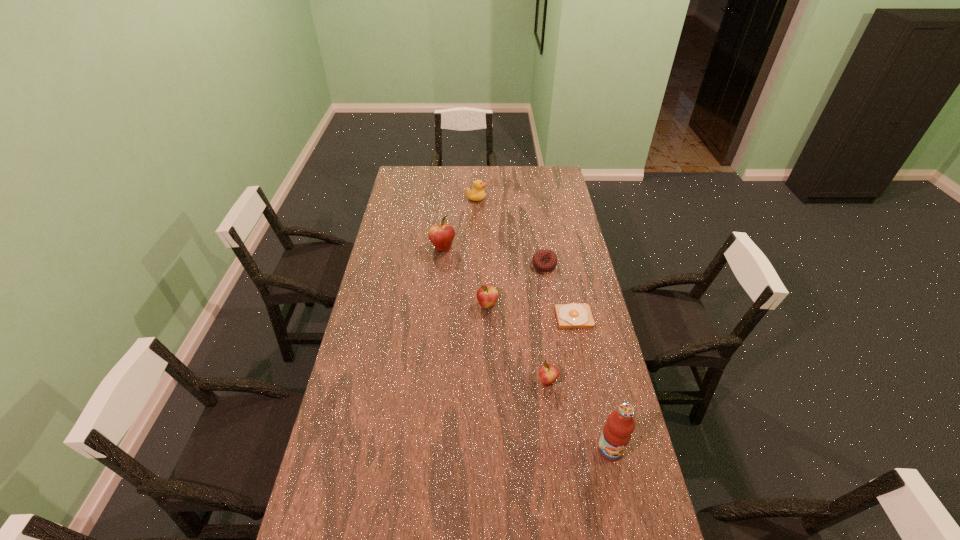
I want to click on beanbag that is at the right edge, so click(x=544, y=260).

In the image, there is a desktop. Find the location of `vacant space at the far edge`. vacant space at the far edge is located at coordinates (435, 178).

This screenshot has height=540, width=960. Find the location of `vacant position at the near edge of the desktop`. vacant position at the near edge of the desktop is located at coordinates (492, 523).

In the image, there is a desktop. Find the location of `free space at the left edge`. free space at the left edge is located at coordinates (386, 313).

Find the location of a particular element. vacant region at the right edge of the desktop is located at coordinates (559, 249).

I want to click on blank space at the far left corner of the desktop, so click(415, 184).

I want to click on vacant space at the near left corner of the desktop, so click(x=340, y=539).

This screenshot has width=960, height=540. I want to click on vacant area at the near right corner, so click(623, 519).

The image size is (960, 540). What are the coordinates of `free space between the leftmost object and the toast` in the screenshot? It's located at (509, 283).

Find the location of a particular element. This screenshot has height=540, width=960. empty location between the sixth shortest object and the sixth tallest object is located at coordinates [493, 257].